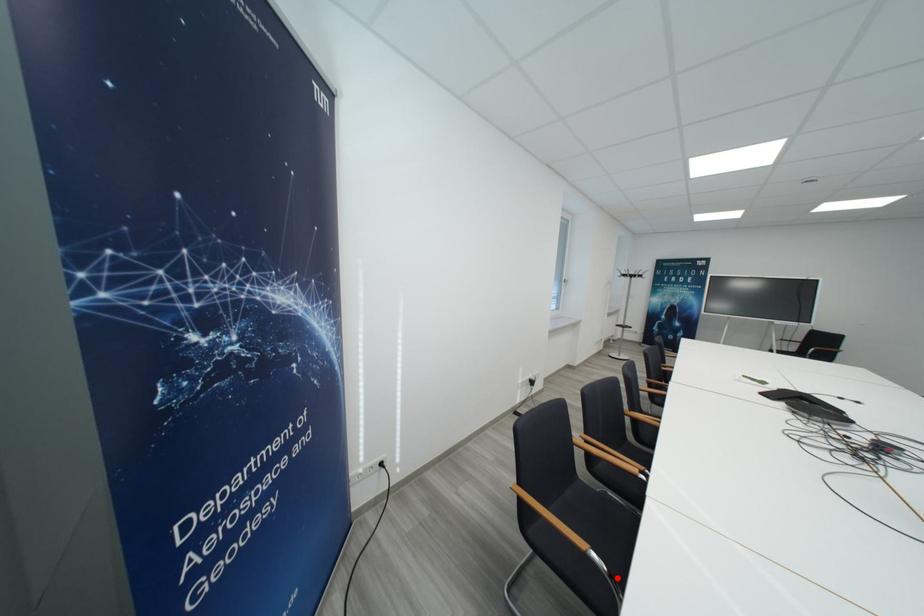
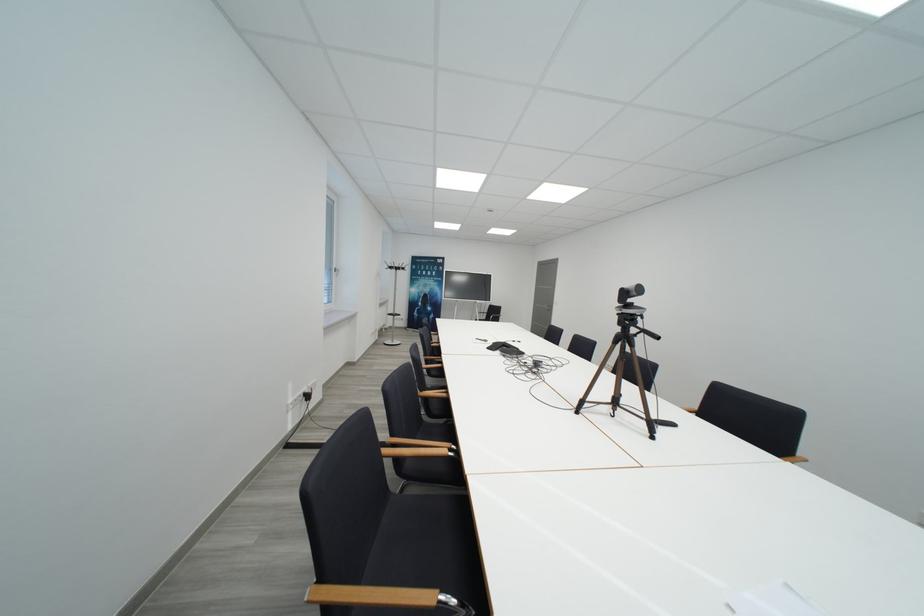
Where in the second image is the point corresponding to the highlighted location from the first image?

(468, 607)